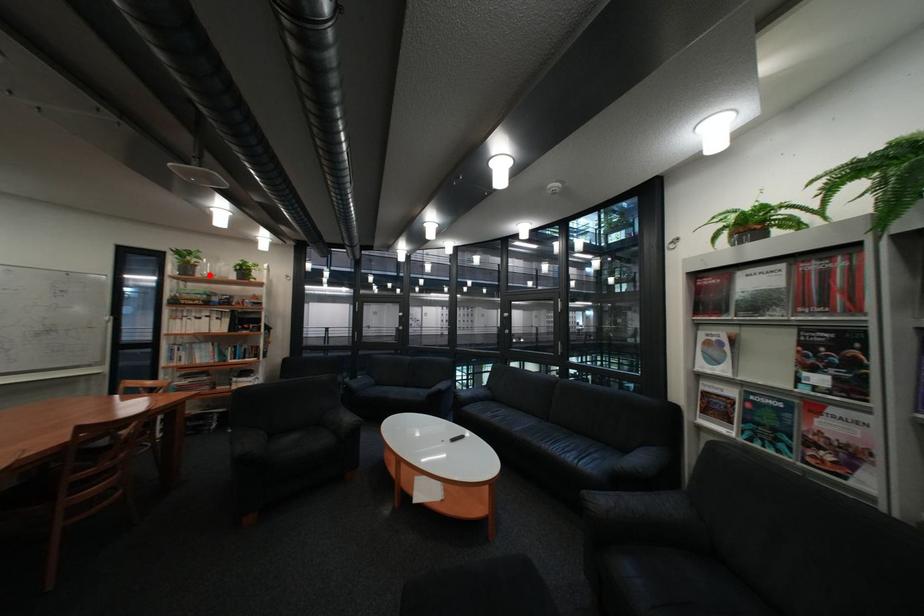
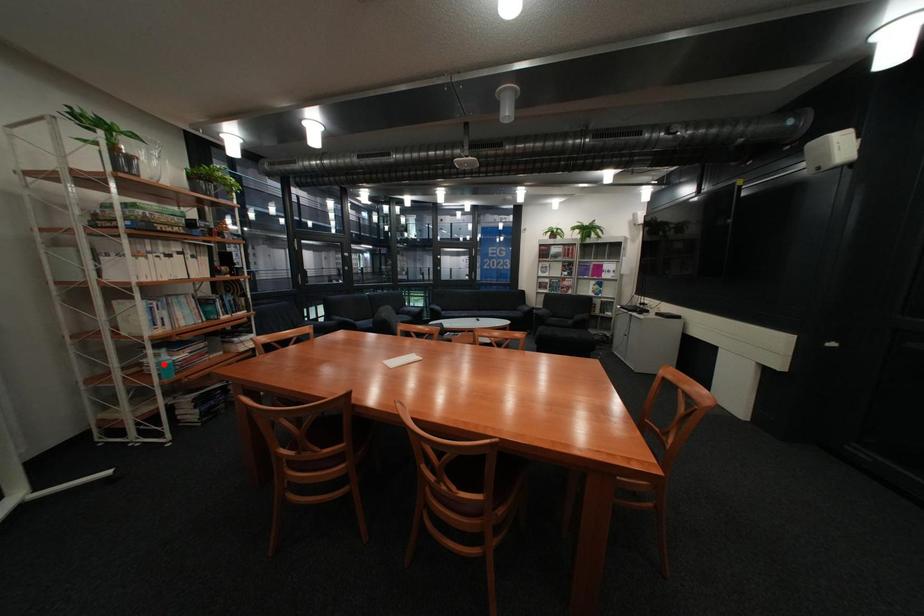
I am providing you with two images of the same scene from different viewpoints. A red point is marked on the first image and another point is marked on the second image. Is the marked point in image1 the same physical position as the marked point in image2?

No